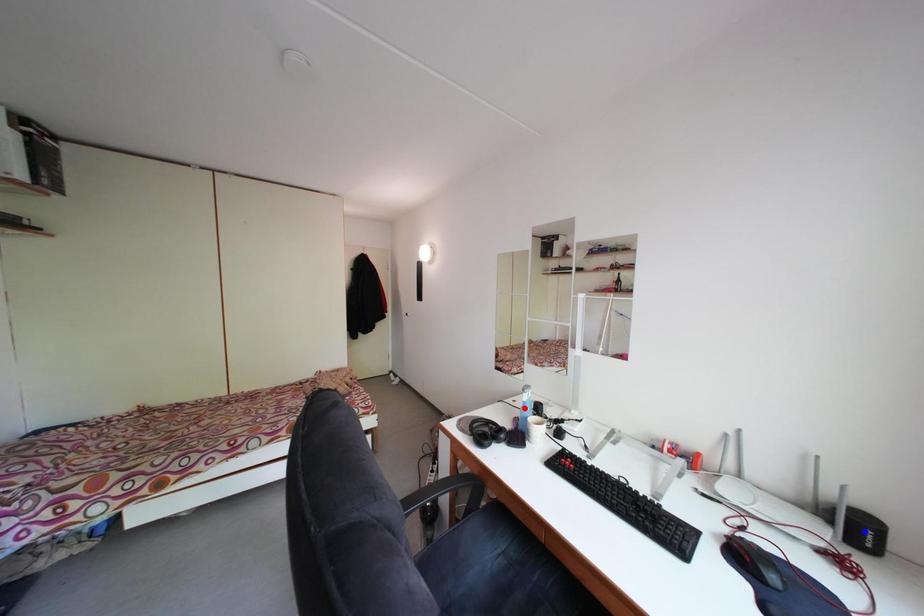
Question: Two points are marked on the image. Which point is closer to the camera?

Choices:
 (A) Blue point is closer.
 (B) Red point is closer.

Answer: (A)